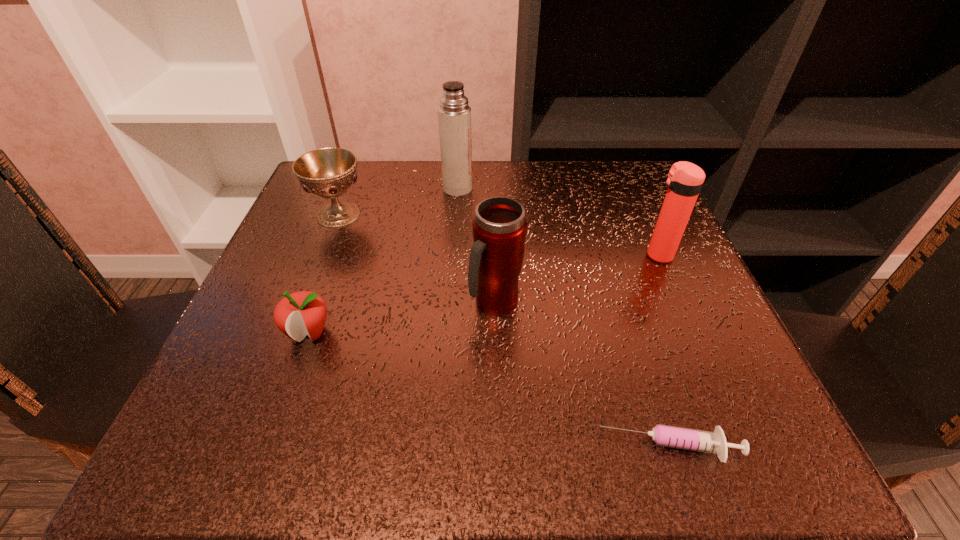
This screenshot has width=960, height=540. Find the location of `vacant space located on the left of the farthest object`. vacant space located on the left of the farthest object is located at coordinates (368, 188).

Find the location of a particular element. vacant region located 0.330m on the left of the rightmost thermos bottle is located at coordinates (467, 255).

Locate an element on the screen. vacant space positioned 0.230m on the side with the handle of the nearest thermos bottle is located at coordinates (500, 466).

Locate an element on the screen. This screenshot has width=960, height=540. vacant space located on the right of the chalice is located at coordinates (477, 214).

Locate an element on the screen. vacant position located on the front of the fifth tallest object is located at coordinates (271, 440).

At what (x,y) coordinates should I click in order to perform the action: click on vacant space located 0.310m on the back of the syringe. Please return your answer as a coordinate pair (x, y). Looking at the image, I should click on (613, 269).

The height and width of the screenshot is (540, 960). I want to click on thermos bottle that is at the far edge, so click(x=454, y=114).

Identify the location of chalice that is at the far edge. (327, 172).

Image resolution: width=960 pixels, height=540 pixels. I want to click on object present at the near edge, so click(714, 442).

Where is `chalice that is at the left edge`? This screenshot has height=540, width=960. chalice that is at the left edge is located at coordinates (327, 172).